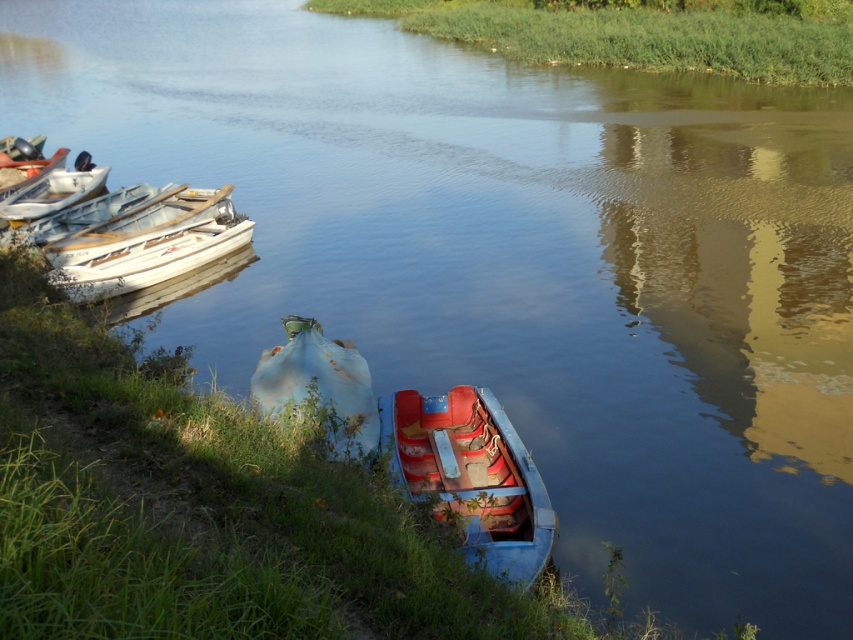
Looking at this image, you are standing at the riverside and want to board the closest boat. Which boat should you choose between the blue faded fabric boat at center and the white plastic boats at left?

The blue faded fabric boat at center is closer to the viewer than the white plastic boats at left, so you should choose the blue faded fabric boat at center.

You are standing at the riverside and want to take a photo of the two points marked in the scene. Which point, point (x=318, y=419) or point (x=65, y=198), will appear larger in your camera view?

Point (x=318, y=419) will appear larger in your camera view because it is closer to the camera than point (x=65, y=198).

You are planning to take a short trip on the river and need a boat that can carry 4 people comfortably. The blue faded fabric boat at center and the white plastic boats at left are available. Which boat should you choose?

A: The blue faded fabric boat at center is bigger than the white plastic boats at left, so it can carry 4 people more comfortably.